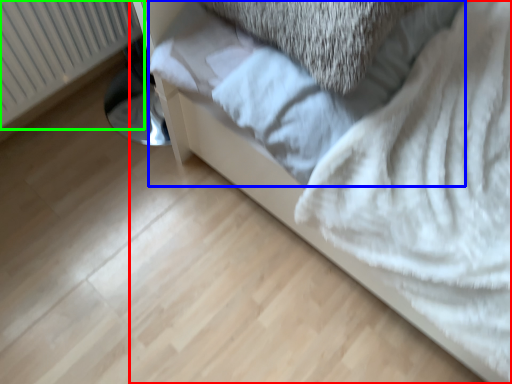
Question: Considering the real-world distances, which object is farthest from furniture (highlighted by a red box)? sheet (highlighted by a blue box) or radiator (highlighted by a green box)?

Choices:
 (A) sheet
 (B) radiator

Answer: (B)